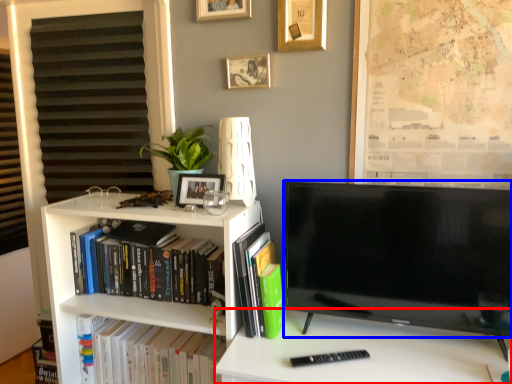
Question: Which object is closer to the camera taking this photo, desk (highlighted by a red box) or television (highlighted by a blue box)?

Choices:
 (A) desk
 (B) television

Answer: (A)